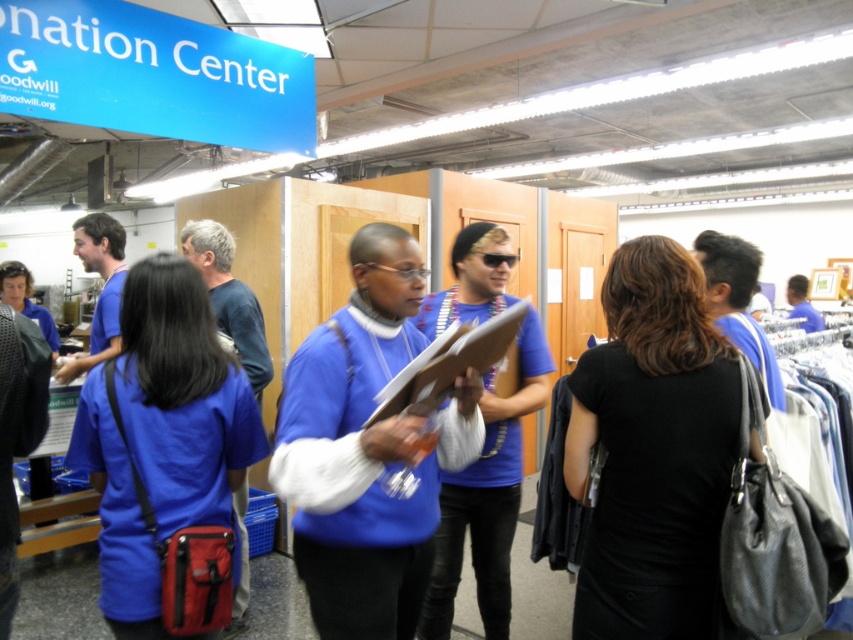
Who is lower down, black leather purse at center or matte blue shirt at center?

Positioned lower is matte blue shirt at center.

Can you confirm if black leather purse at center is positioned to the right of matte blue shirt at center?

Correct, you'll find black leather purse at center to the right of matte blue shirt at center.

The height and width of the screenshot is (640, 853). What do you see at coordinates (653, 449) in the screenshot?
I see `black leather purse at center` at bounding box center [653, 449].

This screenshot has height=640, width=853. In order to click on black leather purse at center in this screenshot , I will do `click(653, 449)`.